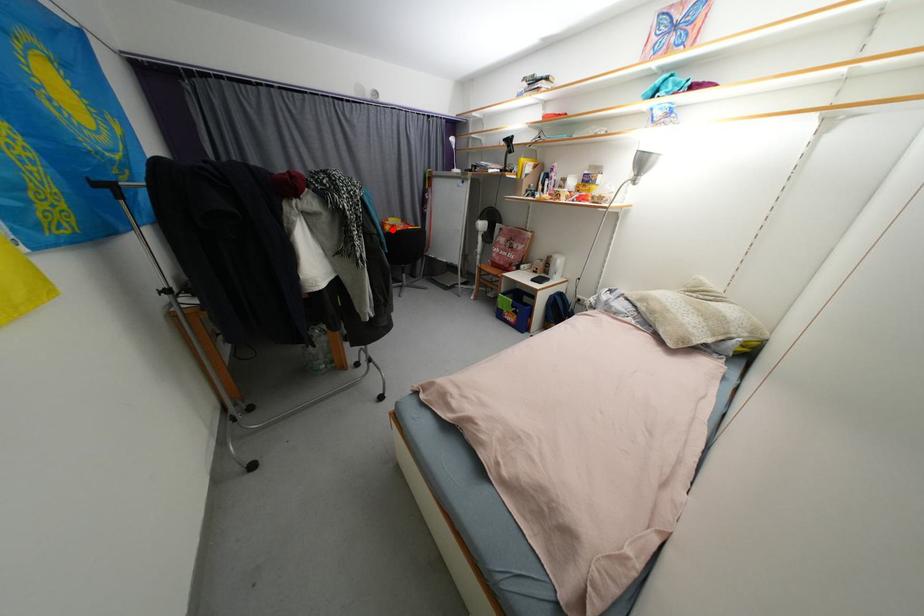
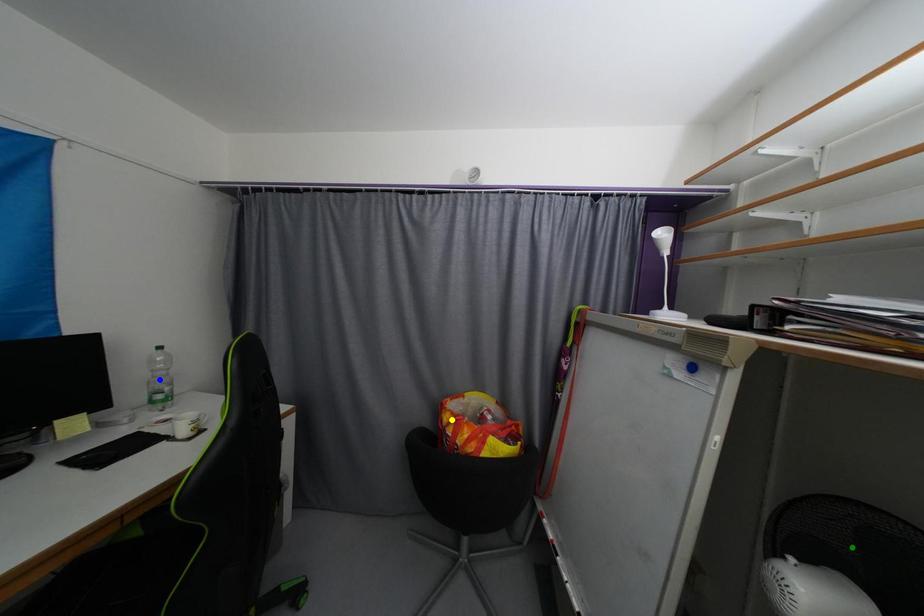
Question: I am providing you with two images of the same scene from different viewpoints. A red point is marked on the first image. You are given multiple points on the second image. Can you choose the point in image 2 that corresponds to the point in image 1?

Choices:
 (A) yellow point
 (B) blue point
 (C) green point

Answer: (A)